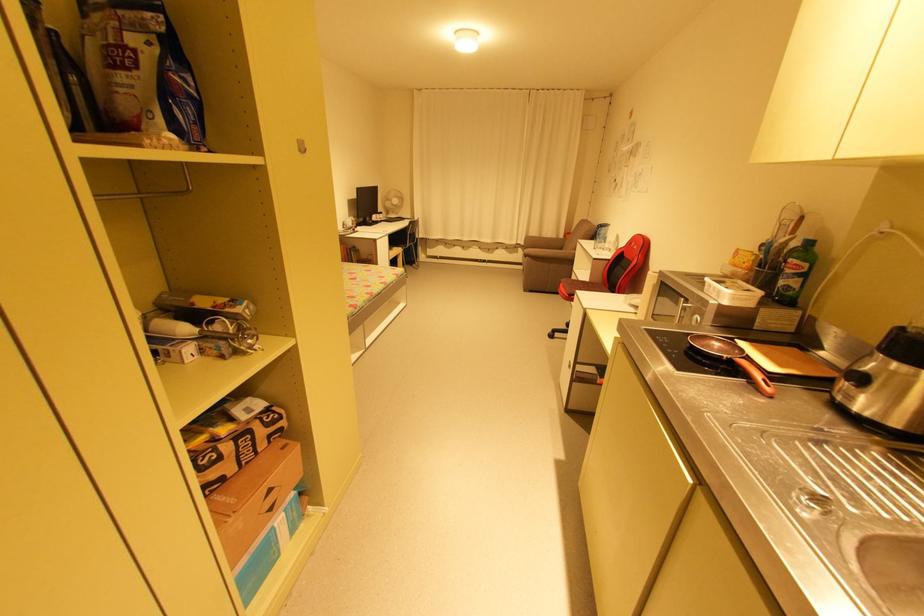
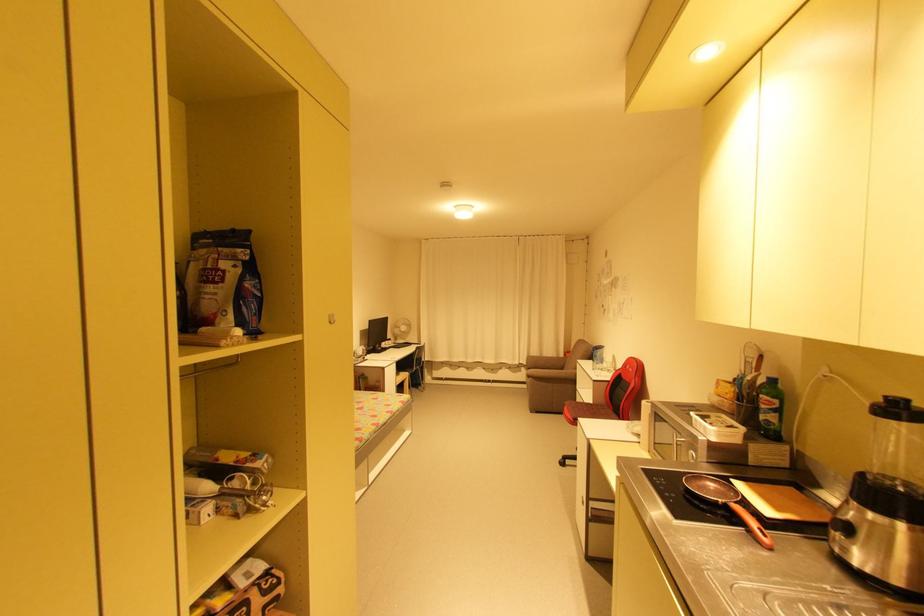
The point at (521,253) is marked in the first image. Where is the corresponding point in the second image?

(525, 371)